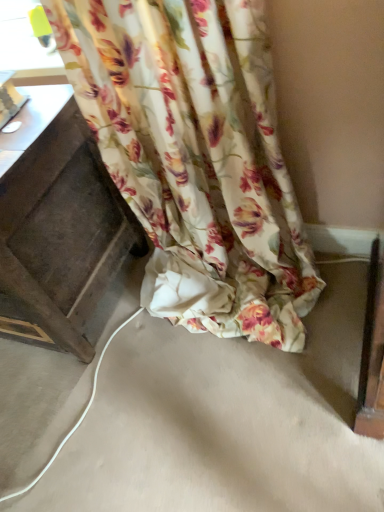
Question: From the image's perspective, is floral fabric curtain at lower center located above or below transparent plastic window at upper left?

Choices:
 (A) below
 (B) above

Answer: (A)

Question: From a real-world perspective, is floral fabric curtain at lower center physically located above or below transparent plastic window at upper left?

Choices:
 (A) above
 (B) below

Answer: (B)

Question: Estimate the real-world distances between objects in this image. Which object is closer to the floral fabric curtain at lower center?

Choices:
 (A) dark wood drawer at left
 (B) transparent plastic window at upper left

Answer: (A)

Question: Estimate the real-world distances between objects in this image. Which object is farther from the dark wood drawer at left?

Choices:
 (A) floral fabric curtain at lower center
 (B) transparent plastic window at upper left

Answer: (B)